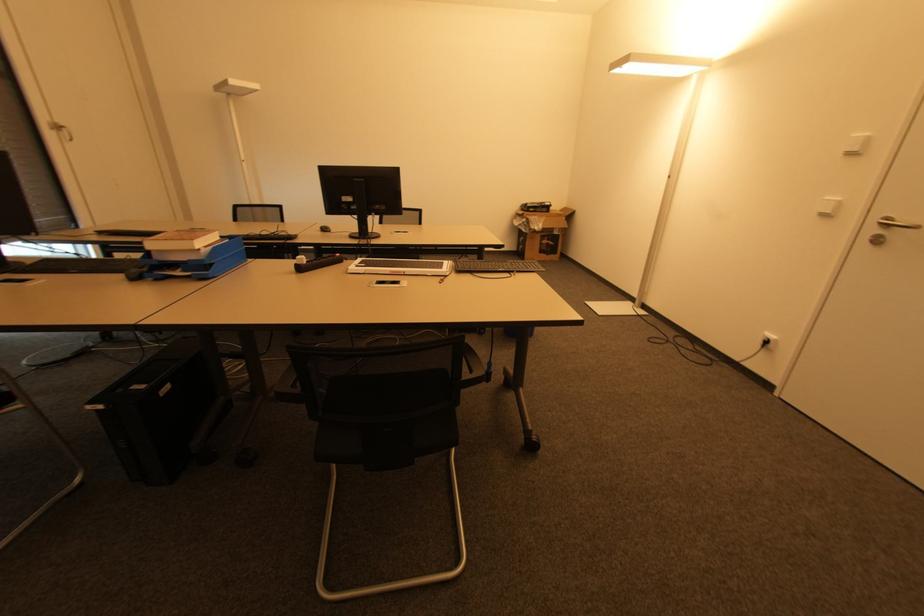
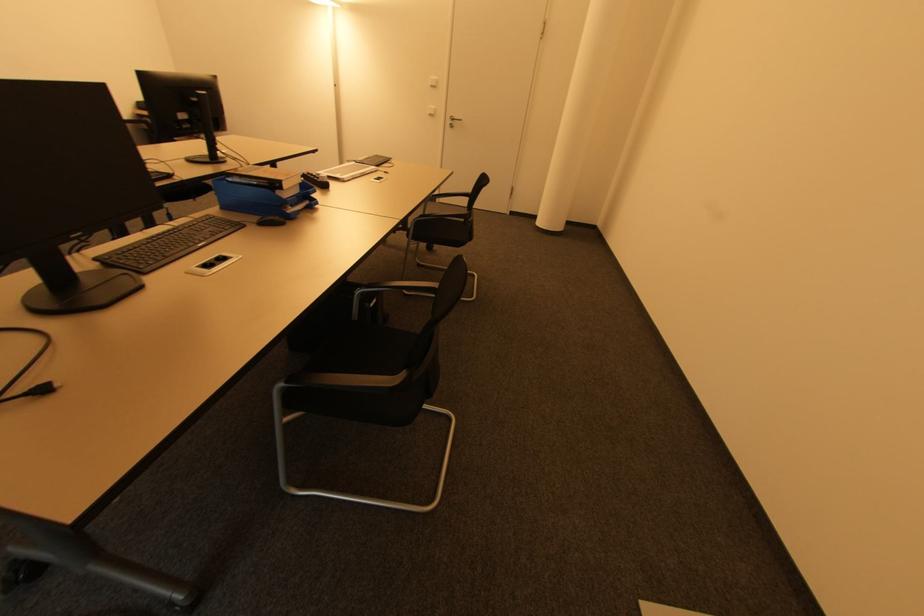
Find the pixel in the second image that matches [186,272] in the first image.

(294, 207)